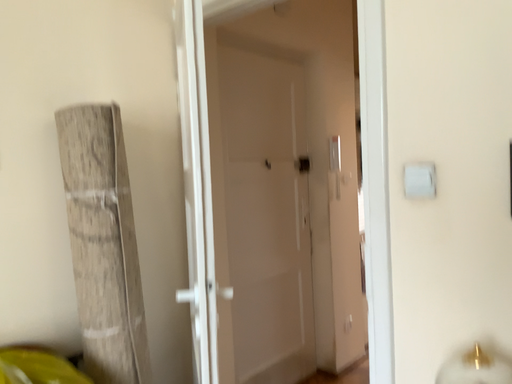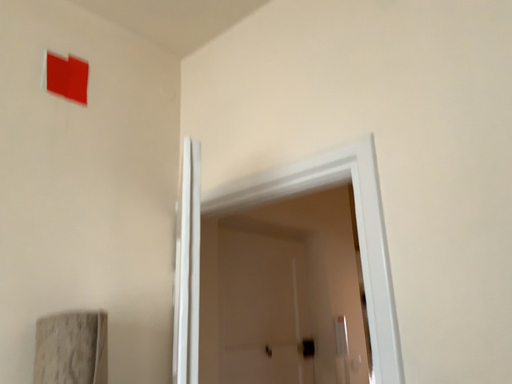
Question: Which way did the camera rotate in the video?

Choices:
 (A) rotated downward
 (B) rotated upward

Answer: (B)